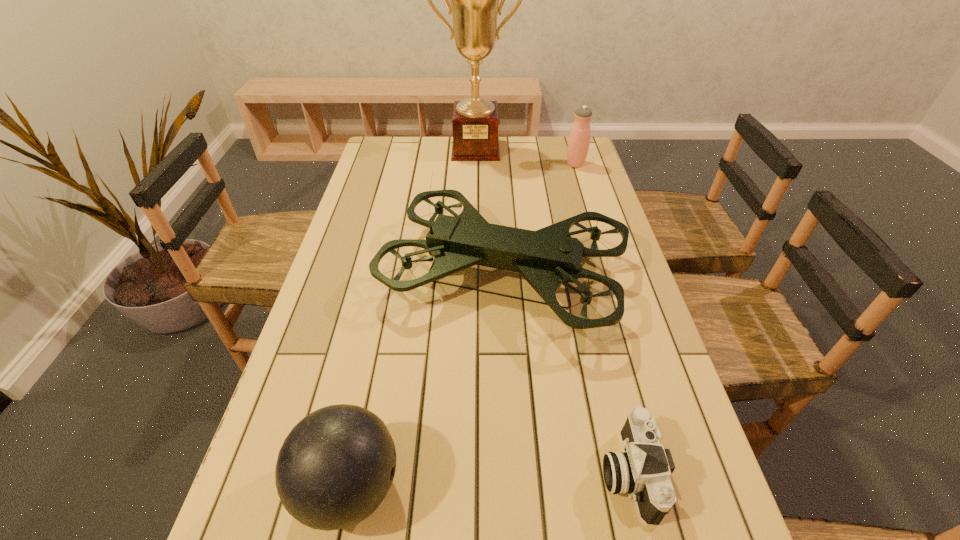
What are the coordinates of `free spot between the second tallest object and the thermos bottle` in the screenshot? It's located at (540, 220).

Locate an element on the screen. vacant area between the third nearest object and the thermos bottle is located at coordinates (540, 220).

Where is `vacant area that lies between the drone and the thermos bottle`? The height and width of the screenshot is (540, 960). vacant area that lies between the drone and the thermos bottle is located at coordinates coord(540,220).

The image size is (960, 540). Find the location of `unoccupied position between the camera and the trophy cup`. unoccupied position between the camera and the trophy cup is located at coordinates (552, 311).

Where is `free spot between the drone and the tallest object`? This screenshot has height=540, width=960. free spot between the drone and the tallest object is located at coordinates (490, 212).

Where is `object that stands as the second closest to the tallest object`? This screenshot has width=960, height=540. object that stands as the second closest to the tallest object is located at coordinates (546, 258).

Choose which object is the second nearest neighbor to the thermos bottle. Please provide its 2D coordinates. Your answer should be formatted as a tuple, i.e. [(x, y)], where the tuple contains the x and y coordinates of a point satisfying the conditions above.

[(546, 258)]

At what (x,y) coordinates should I click in order to perform the action: click on vacant space that satisfies the following two spatial constraints: 1. on the back side of the thermos bottle; 2. on the right side of the shortest object. Please return your answer as a coordinate pair (x, y). This screenshot has width=960, height=540. Looking at the image, I should click on (555, 164).